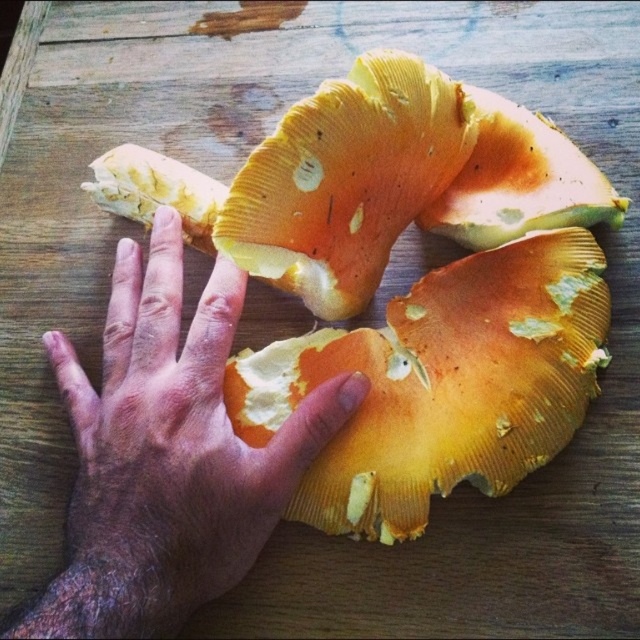
Is yellow soft mushroom at center to the right of dry skin at center from the viewer's perspective?

Correct, you'll find yellow soft mushroom at center to the right of dry skin at center.

Between point (355, 68) and point (97, 493), which one is positioned in front?

Positioned in front is point (97, 493).

Between point (513, 417) and point (152, 456), which one is positioned in front?

Point (152, 456) is more forward.

I want to click on yellow soft mushroom at center, so click(410, 289).